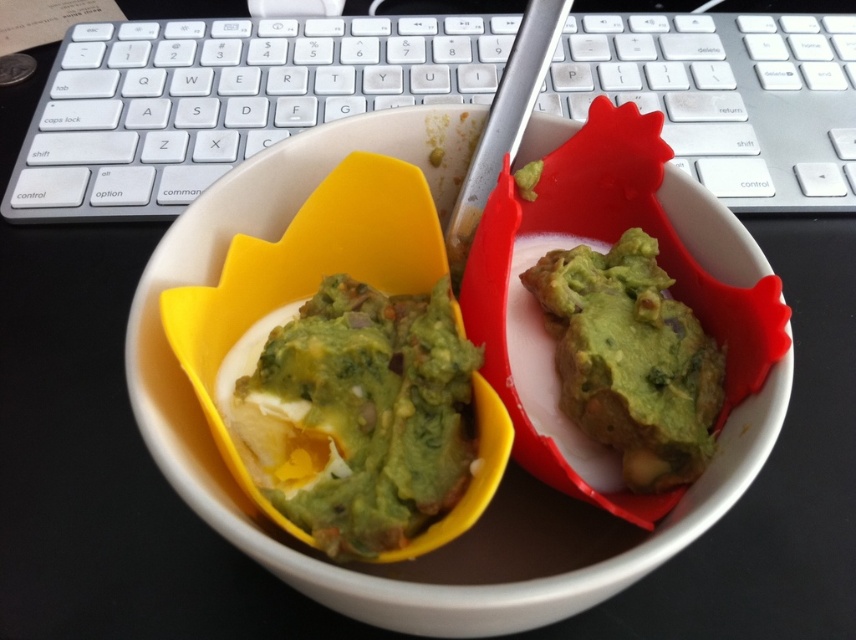
You are a robotic arm trying to pick up the green matte guacamole at center. What are the coordinates where you should aim your suction cup?

The coordinates for the green matte guacamole at center are at point (355, 413).

You are organizing a snack station and need to place the white matte bowl at center and the green matte guacamole at right. Based on the image, which item is positioned higher up?

The white matte bowl at center is located above the green matte guacamole at right, so it is positioned higher up.

You are organizing a snack station and need to place the white matte bowl at center and the green matte guacamole at center on a shelf. Based on their positions in the image, which one should you place first to maintain the same arrangement?

The white matte bowl at center is to the right of the green matte guacamole at center, so you should place the green matte guacamole at center first on the left side of the shelf, followed by the white matte bowl at center to its right to maintain the same arrangement.